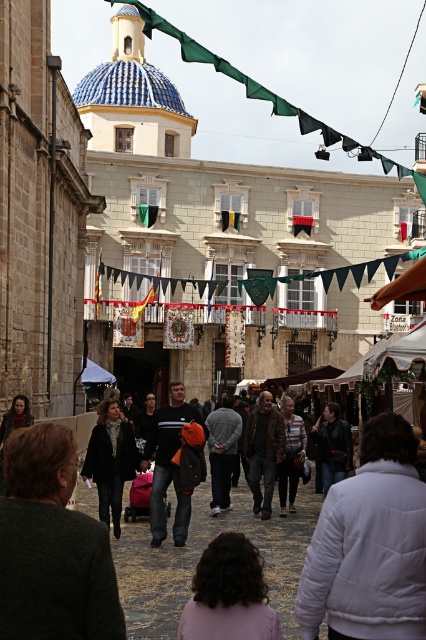
Question: Can you confirm if pink fabric at lower center is positioned to the left of dark gray fabric crowd at center?

Choices:
 (A) no
 (B) yes

Answer: (B)

Question: Which point appears farthest from the camera in this image?

Choices:
 (A) (241, 552)
 (B) (293, 413)

Answer: (B)

Question: Is white puffy jacket at lower right below striped sweater at center?

Choices:
 (A) no
 (B) yes

Answer: (A)

Question: Which object is farther from the camera taking this photo?

Choices:
 (A) dark brown leather jacket at center
 (B) pink fabric at lower center

Answer: (A)

Question: Among these objects, which one is farthest from the camera?

Choices:
 (A) white puffy jacket at lower right
 (B) dark brown leather jacket at center

Answer: (B)

Question: Does pink fabric at lower center have a lesser width compared to dark brown leather jacket at center?

Choices:
 (A) yes
 (B) no

Answer: (A)